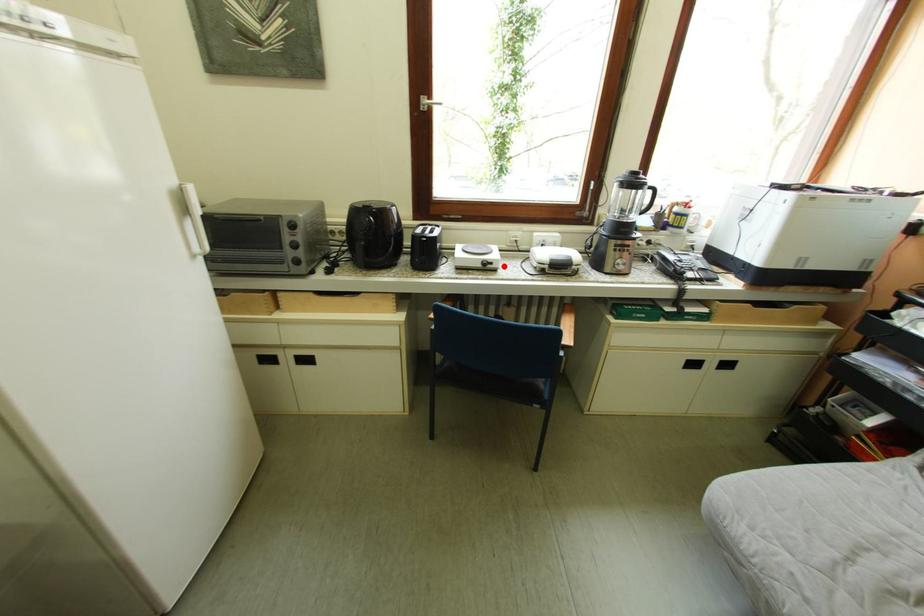
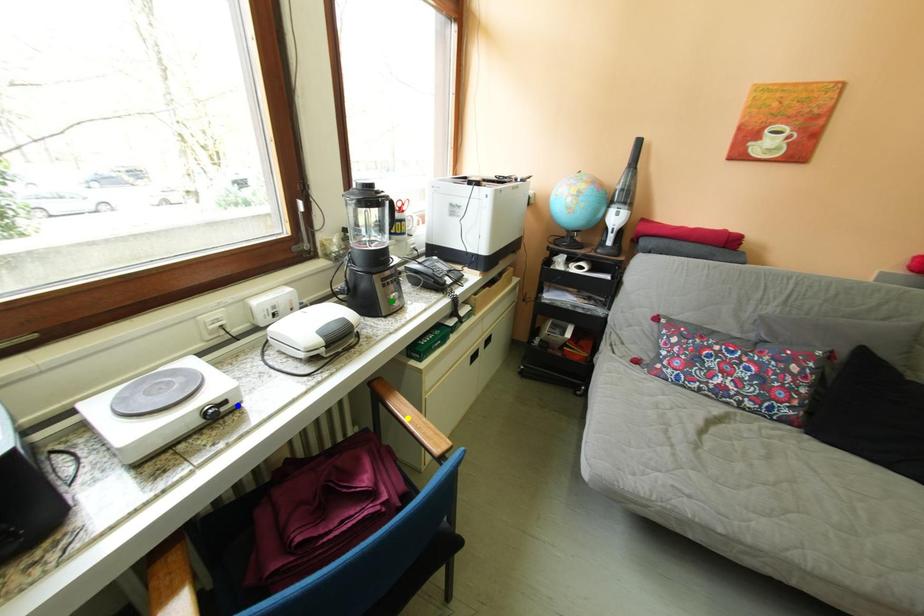
Question: I am providing you with two images of the same scene from different viewpoints. A red point is marked on the first image. You are given multiple points on the second image. Can you choose the point in image 2 that corresponds to the point in image 1?

Choices:
 (A) yellow point
 (B) blue point
 (C) green point

Answer: (B)